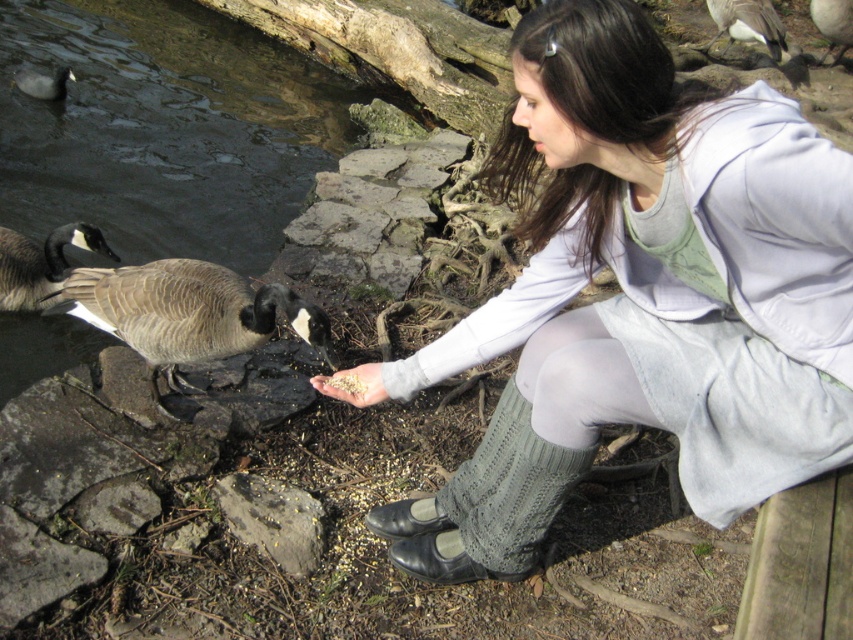
Is gray feathered goose at left positioned behind light brown textured hand at center?

Yes.

Who is more distant from viewer, (45, 276) or (328, 381)?

The point (45, 276) is more distant.

Find the location of `gray feathered goose at left`. gray feathered goose at left is located at coordinates (39, 262).

Measure the distance between brown feathered duck at upper center and light brown textured hand at center.

A distance of 18.34 feet exists between brown feathered duck at upper center and light brown textured hand at center.

Does brown feathered duck at upper center have a larger size compared to light brown textured hand at center?

Yes, brown feathered duck at upper center is bigger than light brown textured hand at center.

Is point (747, 35) closer to camera compared to point (364, 380)?

That is False.

You are a GUI agent. You are given a task and a screenshot of the screen. Output one action in this format:
    pyautogui.click(x=<x>, y=<y>)
    Task: Click on the brown feathered duck at upper center
    
    Given the screenshot: What is the action you would take?
    tap(747, 22)

Can you confirm if brown feathered duck at left is shorter than light brown textured hand at center?

No, brown feathered duck at left is not shorter than light brown textured hand at center.

Describe the element at coordinates (186, 314) in the screenshot. Image resolution: width=853 pixels, height=640 pixels. I see `brown feathered duck at left` at that location.

Where is `brown feathered duck at left`? The image size is (853, 640). brown feathered duck at left is located at coordinates (186, 314).